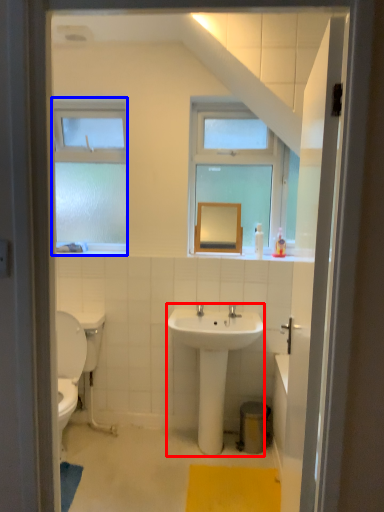
Question: Which object is further to the camera taking this photo, sink (highlighted by a red box) or window (highlighted by a blue box)?

Choices:
 (A) sink
 (B) window

Answer: (B)